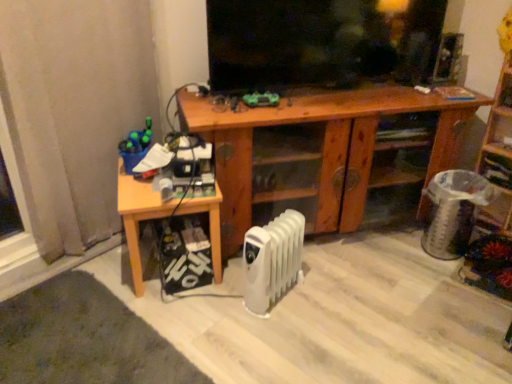
You are a GUI agent. You are given a task and a screenshot of the screen. Output one action in this format:
    pyautogui.click(x=<x>, y=<y>)
    Task: Click on the matte plastic pen holder at left, placed as the first toy when sorted from left to right
    This screenshot has height=384, width=512.
    Given the screenshot: What is the action you would take?
    pyautogui.click(x=135, y=146)

The image size is (512, 384). What do you see at coordinates (324, 145) in the screenshot? I see `wooden cabinet at center` at bounding box center [324, 145].

Identify the location of wooden cabinet at center. This screenshot has height=384, width=512. (324, 145).

Measure the distance between black glossy tv at upper center and camera.

black glossy tv at upper center and camera are 5.41 feet apart from each other.

Measure the distance between white plastic radiator at lower center and camera.

1.62 meters.

Where is `wooden bookshelf at right`? The image size is (512, 384). wooden bookshelf at right is located at coordinates (499, 152).

Where is `matte plastic pen holder at left, the second toy when ordered from top to bottom`? matte plastic pen holder at left, the second toy when ordered from top to bottom is located at coordinates (135, 146).

Where is `radiator that is in front of the light wood table at lower left`? radiator that is in front of the light wood table at lower left is located at coordinates (272, 260).

Could you tell me if white plastic radiator at lower center is turned towards light wood table at lower left?

No, white plastic radiator at lower center is not facing towards light wood table at lower left.

Which is behind, point (288, 267) or point (138, 275)?

The point (288, 267) is more distant.

Is matte plastic pen holder at left, the second toy when ordered from top to bottom, facing away from wooden cabinet at center?

No, matte plastic pen holder at left, the second toy when ordered from top to bottom, is not facing the opposite direction of wooden cabinet at center.

Which object is positioned more to the right, matte plastic pen holder at left, placed as the first toy when sorted from left to right, or wooden cabinet at center?

Positioned to the right is wooden cabinet at center.

Considering the sizes of objects matte plastic pen holder at left, which ranks as the first toy in bottom-to-top order, and wooden cabinet at center in the image provided, who is smaller, matte plastic pen holder at left, which ranks as the first toy in bottom-to-top order, or wooden cabinet at center?

Smaller between the two is matte plastic pen holder at left, which ranks as the first toy in bottom-to-top order.

From a real-world perspective, is black glossy tv at upper center physically above white plastic radiator at lower center?

Yes.

Considering the points (350, 47) and (274, 275), which point is behind, point (350, 47) or point (274, 275)?

The point (350, 47) is farther.

Is black glossy tv at upper center with white plastic radiator at lower center?

No.

Looking at this image, could you tell me if green matte toy at center, placed as the second toy when sorted from left to right, is turned towards matte plastic pen holder at left, which ranks as the first toy in bottom-to-top order?

No, green matte toy at center, placed as the second toy when sorted from left to right, does not turn towards matte plastic pen holder at left, which ranks as the first toy in bottom-to-top order.

Can we say green matte toy at center, the 2th toy ordered from the bottom, lies outside matte plastic pen holder at left, placed as the first toy when sorted from left to right?

Absolutely, green matte toy at center, the 2th toy ordered from the bottom, is external to matte plastic pen holder at left, placed as the first toy when sorted from left to right.

From a real-world perspective, which is physically below, green matte toy at center, which appears as the 1th toy when viewed from the right, or matte plastic pen holder at left, positioned as the second toy in right-to-left order?

From a 3D spatial view, matte plastic pen holder at left, positioned as the second toy in right-to-left order, is below.

How many degrees apart are the facing directions of matte plastic pen holder at left, the second toy when ordered from top to bottom, and light wood table at lower left?

The facing directions of matte plastic pen holder at left, the second toy when ordered from top to bottom, and light wood table at lower left are 11.4 degrees apart.

Can you confirm if matte plastic pen holder at left, which ranks as the first toy in bottom-to-top order, is taller than light wood table at lower left?

Incorrect, the height of matte plastic pen holder at left, which ranks as the first toy in bottom-to-top order, is not larger of that of light wood table at lower left.

Is matte plastic pen holder at left, positioned as the second toy in right-to-left order, in contact with light wood table at lower left?

No, matte plastic pen holder at left, positioned as the second toy in right-to-left order, is not next to light wood table at lower left.

Is point (139, 148) positioned behind point (143, 200)?

Yes.

Considering the relative positions of white plastic radiator at lower center and black glossy tv at upper center in the image provided, is white plastic radiator at lower center to the right of black glossy tv at upper center from the viewer's perspective?

No, white plastic radiator at lower center is not to the right of black glossy tv at upper center.

Which object is closer to the camera, white plastic radiator at lower center or black glossy tv at upper center?

white plastic radiator at lower center is closer to the camera.

Measure the distance between white plastic radiator at lower center and black glossy tv at upper center.

The distance of white plastic radiator at lower center from black glossy tv at upper center is 30.92 inches.

Does white plastic radiator at lower center have a lesser width compared to black glossy tv at upper center?

Yes.

Could you tell me if black glossy tv at upper center is turned towards green matte toy at center, placed as the second toy when sorted from left to right?

Yes, black glossy tv at upper center is facing green matte toy at center, placed as the second toy when sorted from left to right.

Is black glossy tv at upper center outside of green matte toy at center, which appears as the 1th toy when viewed from the right?

Yes.

Considering the positions of objects black glossy tv at upper center and green matte toy at center, placed as the first toy when sorted from top to bottom, in the image provided, who is in front, black glossy tv at upper center or green matte toy at center, placed as the first toy when sorted from top to bottom,?

black glossy tv at upper center is more forward.

In order to click on table behind the white plastic radiator at lower center in this screenshot , I will do `click(138, 216)`.

This screenshot has height=384, width=512. What are the coordinates of `toy that is the 1st object located above the wooden cabinet at center (from the image's perspective)` in the screenshot? It's located at (135, 146).

Which object lies nearer to the anchor point matte plastic pen holder at left, the second toy when ordered from top to bottom, light wood table at lower left or black glossy tv at upper center?

light wood table at lower left lies closer to matte plastic pen holder at left, the second toy when ordered from top to bottom, than the other object.

Based on their spatial positions, is wooden bookshelf at right or black glossy tv at upper center closer to wooden cabinet at center?

The object closer to wooden cabinet at center is black glossy tv at upper center.

Based on their spatial positions, is light wood table at lower left or white plastic radiator at lower center further from matte plastic pen holder at left, positioned as the second toy in right-to-left order?

The object further to matte plastic pen holder at left, positioned as the second toy in right-to-left order, is white plastic radiator at lower center.

Looking at the image, which one is located closer to black glossy tv at upper center, matte plastic pen holder at left, positioned as the second toy in right-to-left order, or green matte toy at center, the 2th toy ordered from the bottom?

green matte toy at center, the 2th toy ordered from the bottom, lies closer to black glossy tv at upper center than the other object.

In the scene shown: Estimate the real-world distances between objects in this image. Which object is closer to black glossy tv at upper center, matte plastic pen holder at left, positioned as the second toy in right-to-left order, or wooden bookshelf at right?

wooden bookshelf at right is closer to black glossy tv at upper center.

Considering their positions, is light wood table at lower left positioned further to white plastic radiator at lower center than black glossy tv at upper center?

Based on the image, black glossy tv at upper center appears to be further to white plastic radiator at lower center.

When comparing their distances from wooden bookshelf at right, does light wood table at lower left or black glossy tv at upper center seem further?

The object further to wooden bookshelf at right is light wood table at lower left.

Based on their spatial positions, is white plastic radiator at lower center or wooden cabinet at center closer to wooden bookshelf at right?

The object closer to wooden bookshelf at right is wooden cabinet at center.

Image resolution: width=512 pixels, height=384 pixels. Find the location of `tv show situated between light wood table at lower left and wooden cabinet at center from left to right`. tv show situated between light wood table at lower left and wooden cabinet at center from left to right is located at coordinates (319, 43).

Where is `desk between black glossy tv at upper center and white plastic radiator at lower center vertically`? desk between black glossy tv at upper center and white plastic radiator at lower center vertically is located at coordinates (324, 145).

Identify the location of radiator between matte plastic pen holder at left, positioned as the second toy in right-to-left order, and wooden bookshelf at right, in the horizontal direction. The height and width of the screenshot is (384, 512). (272, 260).

Where is `radiator between light wood table at lower left and wooden cabinet at center`? radiator between light wood table at lower left and wooden cabinet at center is located at coordinates [272, 260].